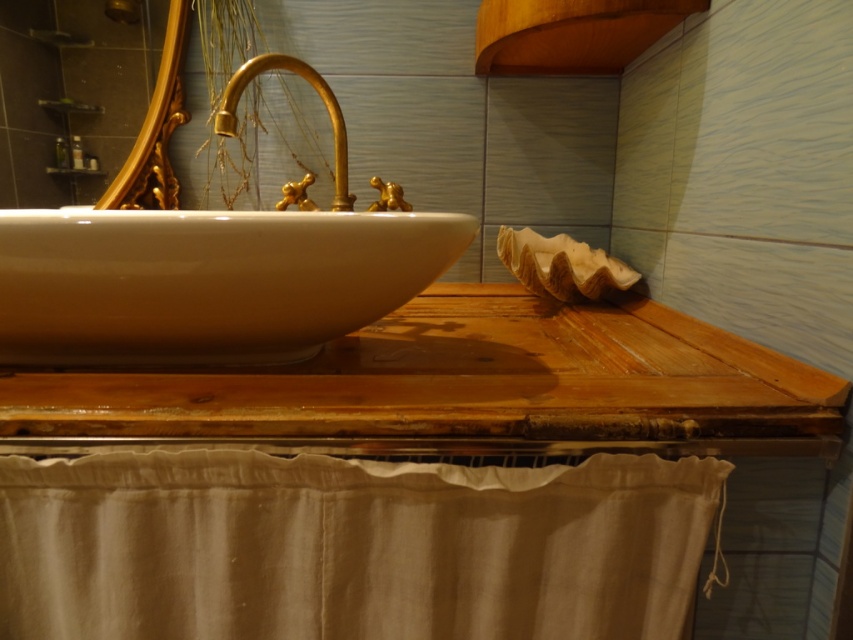
You are designing a bathroom layout and need to ensure that the wooden counter top at center and the gold polished faucet at center are positioned correctly. Based on their sizes, which object should be placed lower to maintain proper functionality?

The wooden counter top at center is shorter than the gold polished faucet at center, so the faucet should be placed lower to ensure it is at a functional height relative to the counter top.

You are a plumber checking the bathroom plumbing. You see the wooden counter top at center and the gold polished faucet at center. Which object is positioned lower in the image?

The wooden counter top at center is below the gold polished faucet at center, so the wooden counter top at center is positioned lower.